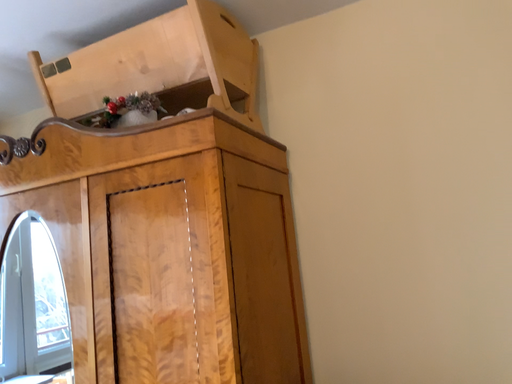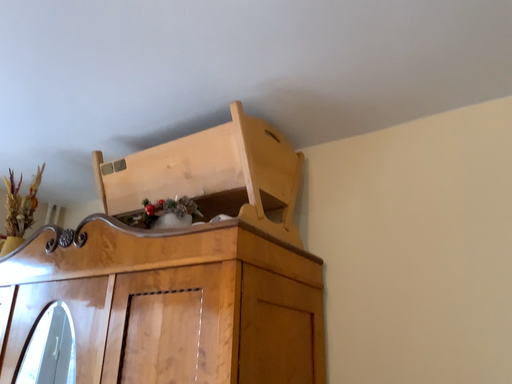
Question: How did the camera likely rotate when shooting the video?

Choices:
 (A) rotated left
 (B) rotated right

Answer: (A)